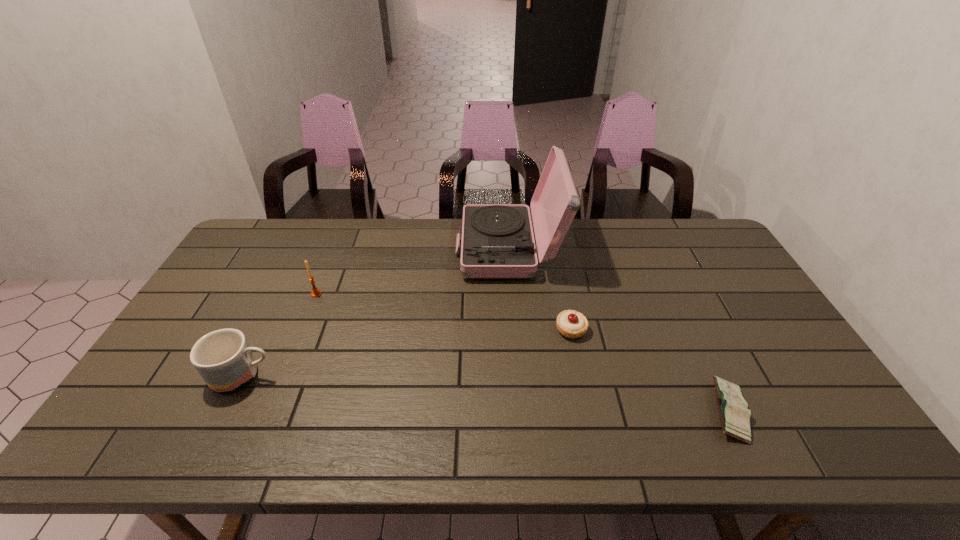
Where is `the farthest object`? The image size is (960, 540). the farthest object is located at coordinates (497, 241).

What are the coordinates of `record player` in the screenshot? It's located at (497, 241).

This screenshot has height=540, width=960. I want to click on the fourth object from right to left, so click(x=316, y=292).

Where is `candle_holder`? This screenshot has width=960, height=540. candle_holder is located at coordinates (316, 292).

The height and width of the screenshot is (540, 960). I want to click on the leftmost object, so click(x=223, y=358).

Image resolution: width=960 pixels, height=540 pixels. Find the location of `the third tallest object`. the third tallest object is located at coordinates (223, 358).

Find the location of a particular element. This screenshot has height=540, width=960. pastry is located at coordinates (572, 324).

In order to click on the second shortest object in this screenshot , I will do `click(572, 324)`.

Where is `the rightmost object`? Image resolution: width=960 pixels, height=540 pixels. the rightmost object is located at coordinates (734, 414).

Where is `the shortest object`? The height and width of the screenshot is (540, 960). the shortest object is located at coordinates (734, 414).